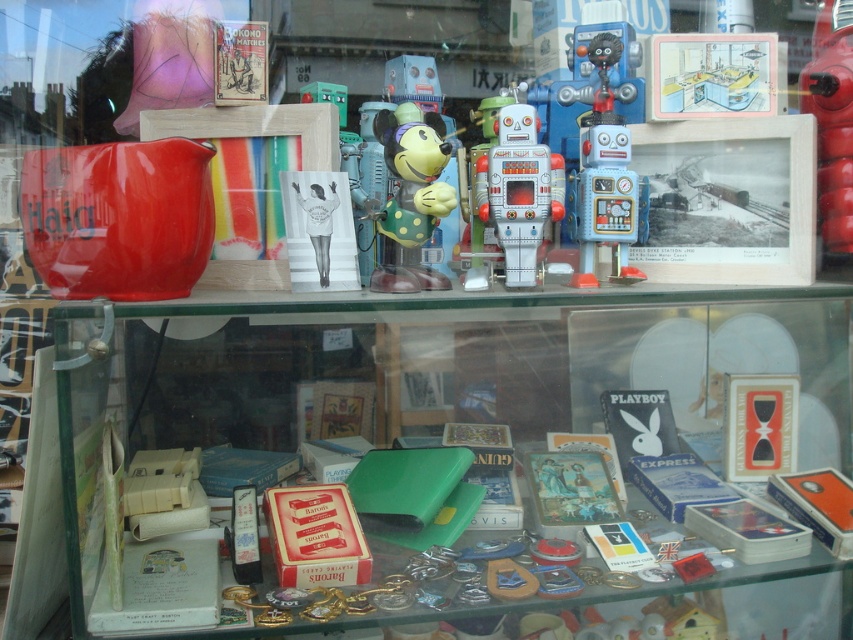
You are a customer in the store looking at the display case. You want to pick up the yellow matte mickey mouse at center and the metallic tin robot at center. Which one do you need to reach into the display case further to get?

You need to reach further into the display case to get the metallic tin robot at center because it is farther from the viewer compared to the yellow matte mickey mouse at center.